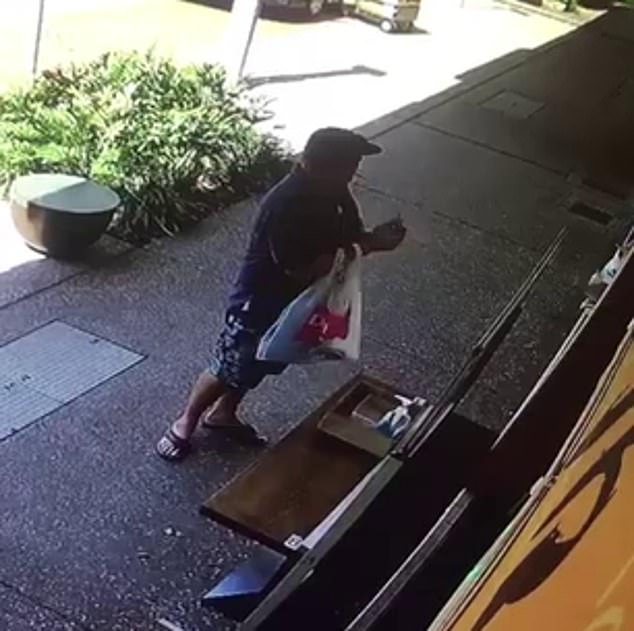
Image resolution: width=634 pixels, height=631 pixels. Find the location of `soap push dispenser bottle`. soap push dispenser bottle is located at coordinates (395, 427).